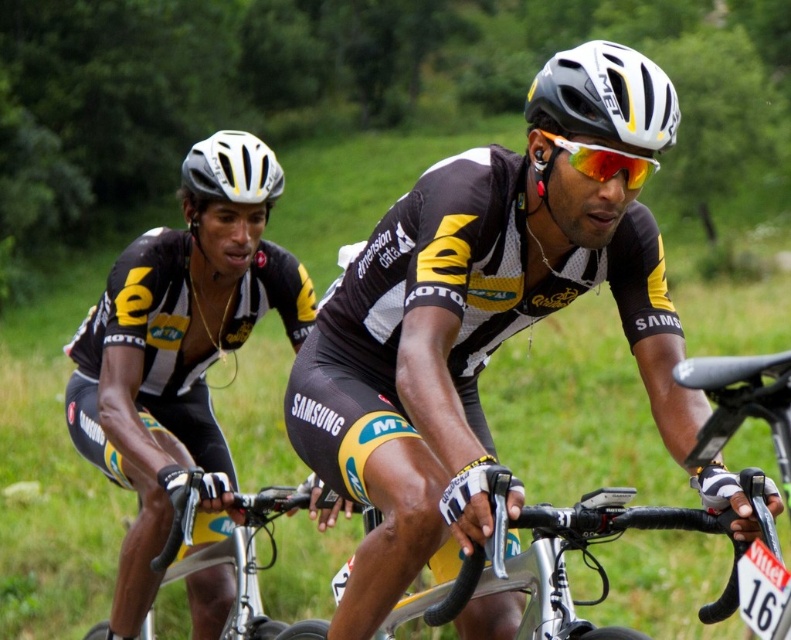
Question: Which is nearer to the white matte bicycle helmet at upper left?

Choices:
 (A) black matte jersey at center
 (B) yellow matte bicycle handlebars at center
 (C) white matte bicycle helmet at upper center
 (D) red reflective lens glasses at center

Answer: (B)

Question: Does matte black cycling jersey at left have a larger size compared to white matte bicycle helmet at upper left?

Choices:
 (A) yes
 (B) no

Answer: (B)

Question: Which point is closer to the camera?

Choices:
 (A) red reflective lens glasses at center
 (B) yellow matte bicycle handlebars at center
 (C) black matte jersey at center

Answer: (C)

Question: Does matte black cycling jersey at left come in front of white matte bicycle helmet at upper left?

Choices:
 (A) yes
 (B) no

Answer: (A)

Question: Is matte black cycling jersey at left wider than yellow matte bicycle handlebars at center?

Choices:
 (A) yes
 (B) no

Answer: (B)

Question: Which object is positioned farthest from the yellow matte bicycle handlebars at center?

Choices:
 (A) white matte bicycle helmet at upper left
 (B) red reflective lens glasses at center
 (C) white matte bicycle helmet at upper center
 (D) matte black cycling jersey at left

Answer: (C)